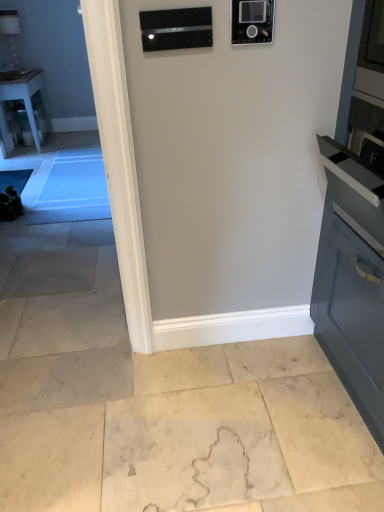
I want to click on empty space that is ontop of beige marble floor at lower center (from a real-world perspective), so click(179, 421).